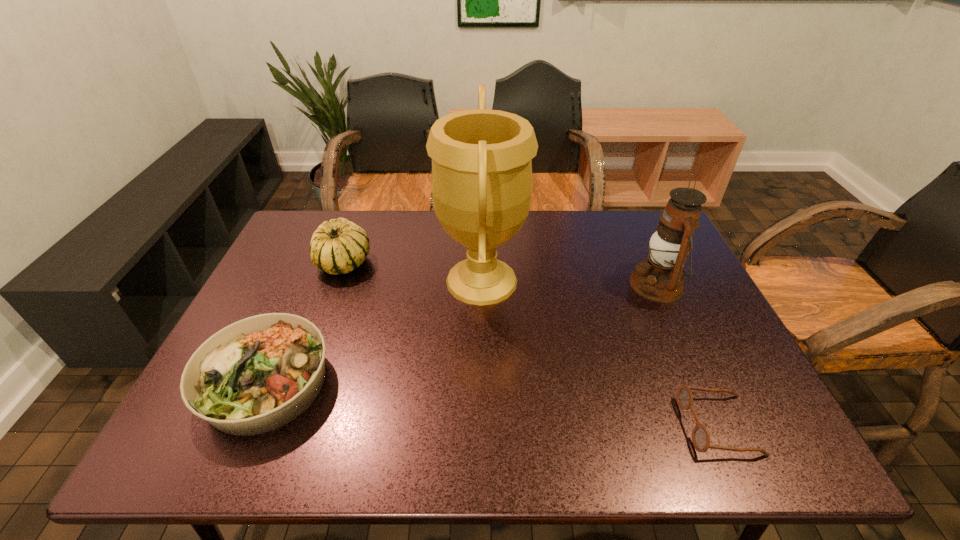
Locate an element on the screen. The width and height of the screenshot is (960, 540). the third object from right to left is located at coordinates [x=481, y=182].

Locate an element on the screen. This screenshot has height=540, width=960. trophy is located at coordinates [x=481, y=182].

The image size is (960, 540). I want to click on the fourth shortest object, so click(660, 278).

Where is `gourd`? Image resolution: width=960 pixels, height=540 pixels. gourd is located at coordinates (339, 246).

Locate an element on the screen. The image size is (960, 540). the second shortest object is located at coordinates (260, 373).

Where is `the shortest object`? the shortest object is located at coordinates (700, 436).

The width and height of the screenshot is (960, 540). What are the coordinates of `vacant area situated 0.060m on the engravings side of the tallest object` in the screenshot? It's located at (416, 280).

Where is `free space located on the engravings side of the tallest object`? This screenshot has width=960, height=540. free space located on the engravings side of the tallest object is located at coordinates (371, 280).

The height and width of the screenshot is (540, 960). Identify the location of vacant area situated on the engravings side of the tallest object. (322, 280).

You are a GUI agent. You are given a task and a screenshot of the screen. Output one action in this format:
    pyautogui.click(x=<x>, y=<y>)
    Task: Click on the vacant space located 0.090m on the side of the fourth shortest object, there is a wick adjustment knob
    
    Given the screenshot: What is the action you would take?
    pyautogui.click(x=598, y=285)